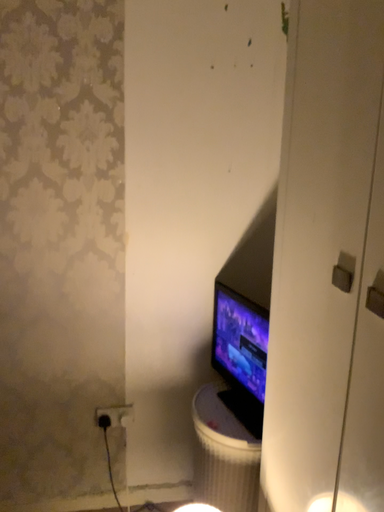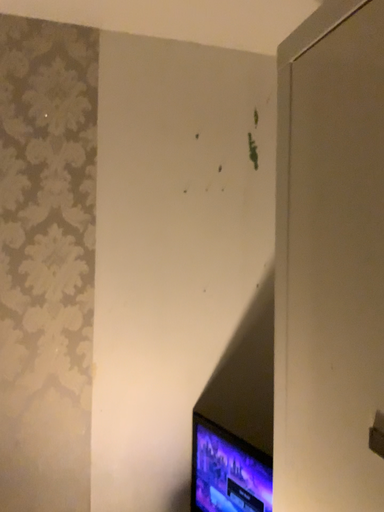
Question: Which way did the camera rotate in the video?

Choices:
 (A) rotated downward
 (B) rotated upward

Answer: (B)